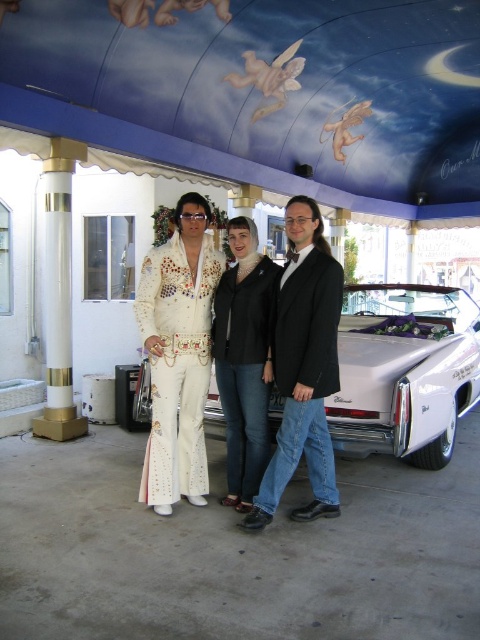
You are a photographer trying to adjust the lighting for a photo shoot. You notice the white satin dress at center and the white glossy column at left in the scene. Which object is shorter?

The white satin dress at center is shorter than the white glossy column at left according to the description.